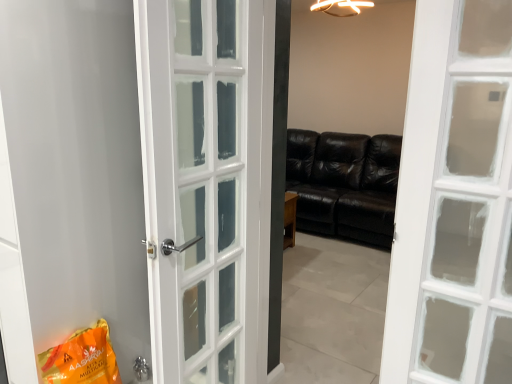
Question: Does black leather couch at center turn towards polished silver door handle at lower center?

Choices:
 (A) no
 (B) yes

Answer: (B)

Question: Considering the relative sizes of black leather couch at center and polished silver door handle at lower center in the image provided, is black leather couch at center bigger than polished silver door handle at lower center?

Choices:
 (A) no
 (B) yes

Answer: (B)

Question: Does black leather couch at center have a greater height compared to polished silver door handle at lower center?

Choices:
 (A) yes
 (B) no

Answer: (A)

Question: Is polished silver door handle at lower center at the back of black leather couch at center?

Choices:
 (A) yes
 (B) no

Answer: (B)

Question: Can you confirm if black leather couch at center is thinner than polished silver door handle at lower center?

Choices:
 (A) yes
 (B) no

Answer: (B)

Question: Does black leather couch at center lie in front of polished silver door handle at lower center?

Choices:
 (A) yes
 (B) no

Answer: (B)

Question: Does black leather couch at center lie in front of white glossy door at left?

Choices:
 (A) no
 (B) yes

Answer: (A)

Question: Does black leather couch at center have a lesser width compared to white glossy door at left?

Choices:
 (A) yes
 (B) no

Answer: (B)

Question: Is black leather couch at center smaller than white glossy door at left?

Choices:
 (A) yes
 (B) no

Answer: (A)

Question: From a real-world perspective, does black leather couch at center sit lower than white glossy door at left?

Choices:
 (A) no
 (B) yes

Answer: (B)

Question: From a real-world perspective, is black leather couch at center on top of white glossy door at left?

Choices:
 (A) no
 (B) yes

Answer: (A)

Question: From the image's perspective, does black leather couch at center appear lower than white glossy door at left?

Choices:
 (A) no
 (B) yes

Answer: (A)

Question: Is the position of orange matte shopping bag at lower left more distant than that of white glossy door at left?

Choices:
 (A) no
 (B) yes

Answer: (B)